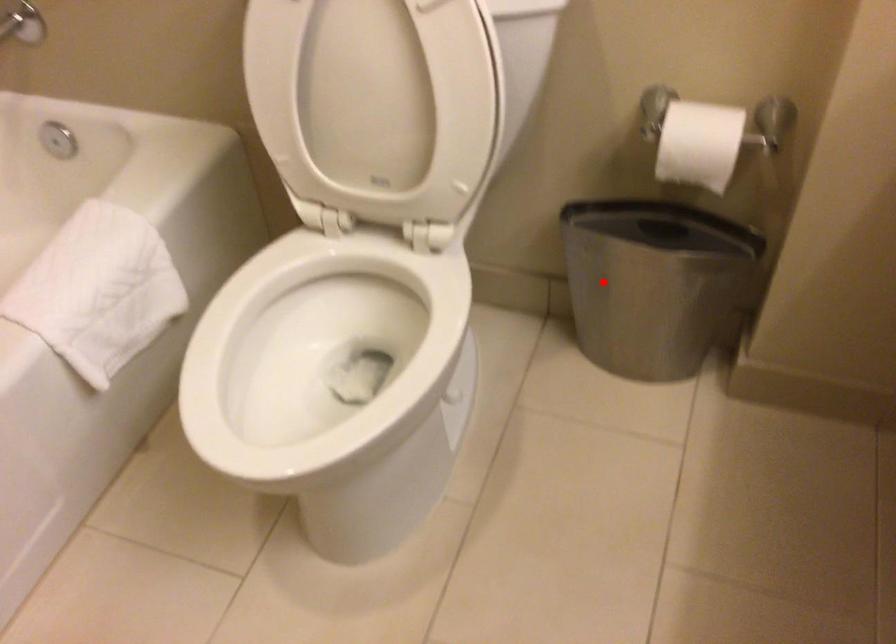
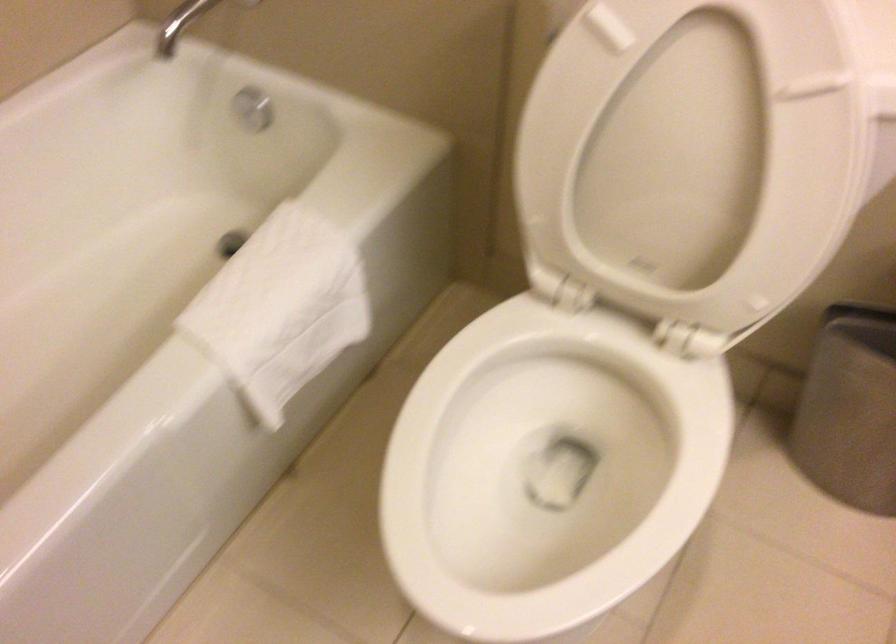
The point at the highlighted location is marked in the first image. Where is the corresponding point in the second image?

(858, 402)